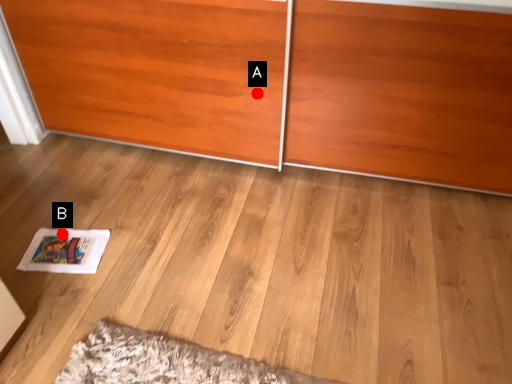
Question: Two points are circled on the image, labeled by A and B beside each circle. Which point is further to the camera?

Choices:
 (A) A is further
 (B) B is further

Answer: (A)